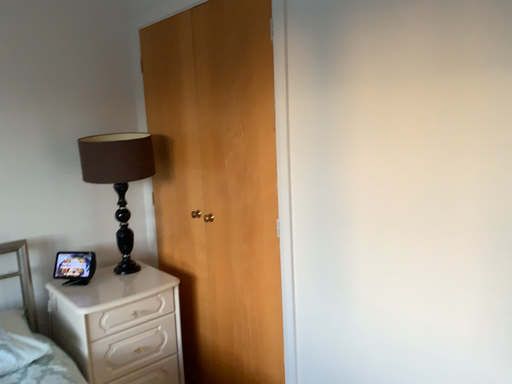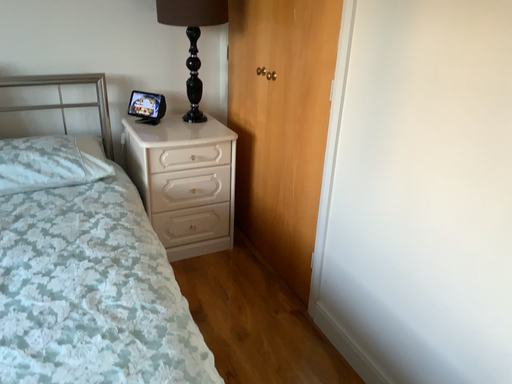
Question: How did the camera likely rotate when shooting the video?

Choices:
 (A) rotated upward
 (B) rotated downward

Answer: (B)